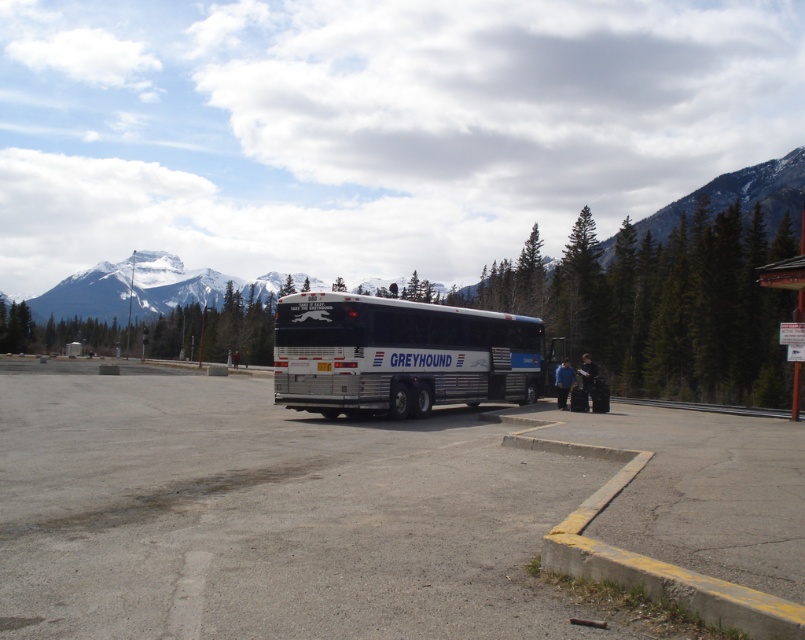
Question: Can you confirm if white metallic bus at center is smaller than black leather jacket at lower center?

Choices:
 (A) no
 (B) yes

Answer: (B)

Question: Can you confirm if gray asphalt parking lot at center is wider than metallic sign at right?

Choices:
 (A) yes
 (B) no

Answer: (A)

Question: Which object is farther from the camera taking this photo?

Choices:
 (A) white metallic bus at center
 (B) gray asphalt parking lot at center
 (C) snowy white mountain at upper center
 (D) black leather jacket at lower center

Answer: (C)

Question: Which object is the farthest from the metallic sign at right?

Choices:
 (A) black leather jacket at lower center
 (B) snowy white mountain at upper center
 (C) white metallic bus at center
 (D) blue fabric jacket at lower center

Answer: (B)

Question: Which object appears closest to the camera in this image?

Choices:
 (A) gray asphalt parking lot at center
 (B) snowy white mountain at upper center
 (C) metallic sign at right
 (D) white metallic bus at center

Answer: (A)

Question: Is snowy white mountain at upper center further to the viewer compared to black leather jacket at lower center?

Choices:
 (A) yes
 (B) no

Answer: (A)